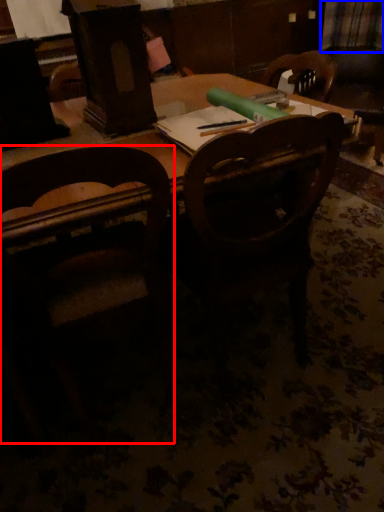
Question: Which object is closer to the camera taking this photo, chair (highlighted by a red box) or plaid (highlighted by a blue box)?

Choices:
 (A) chair
 (B) plaid

Answer: (A)